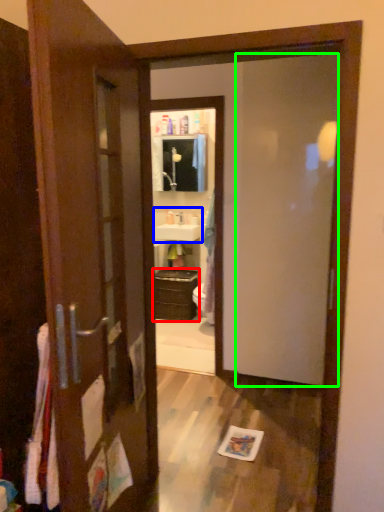
Question: Considering the real-world distances, which object is farthest from cabinetry (highlighted by a red box)? sink (highlighted by a blue box) or screen door (highlighted by a green box)?

Choices:
 (A) sink
 (B) screen door

Answer: (B)